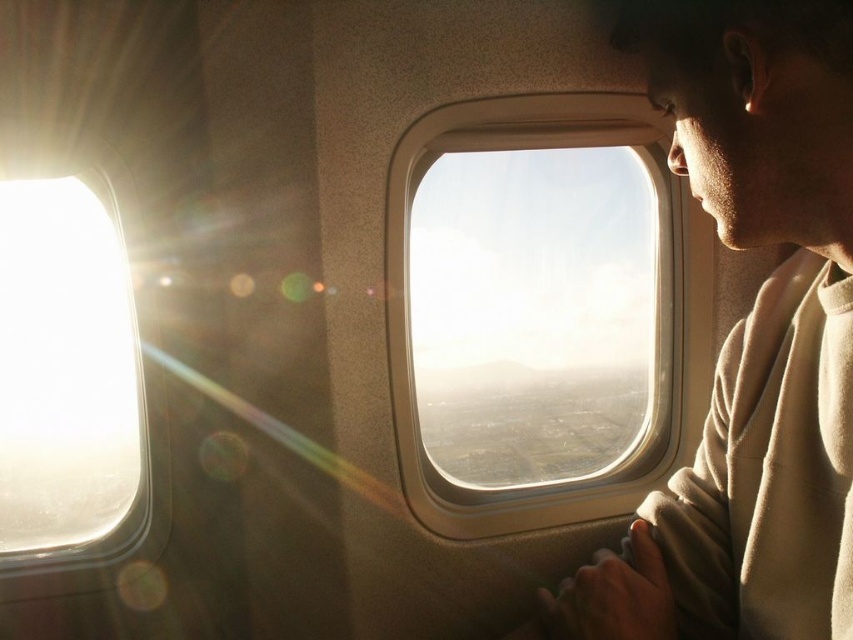
You are a flight attendant carrying a 20 inch tray. You need to place it between the beige fleece at upper right and the transparent glass airplane window at center. Is there enough space?

The beige fleece at upper right and transparent glass airplane window at center are 36.92 inches apart from each other. Since the tray is 20 inches long, there is enough space to place it between them.